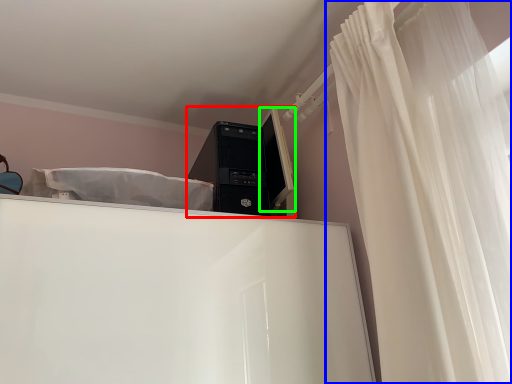
Question: Which object is positioned closest to desktop computer (highlighted by a red box)? Select from curtain (highlighted by a blue box) and computer monitor (highlighted by a green box).

Choices:
 (A) curtain
 (B) computer monitor

Answer: (B)